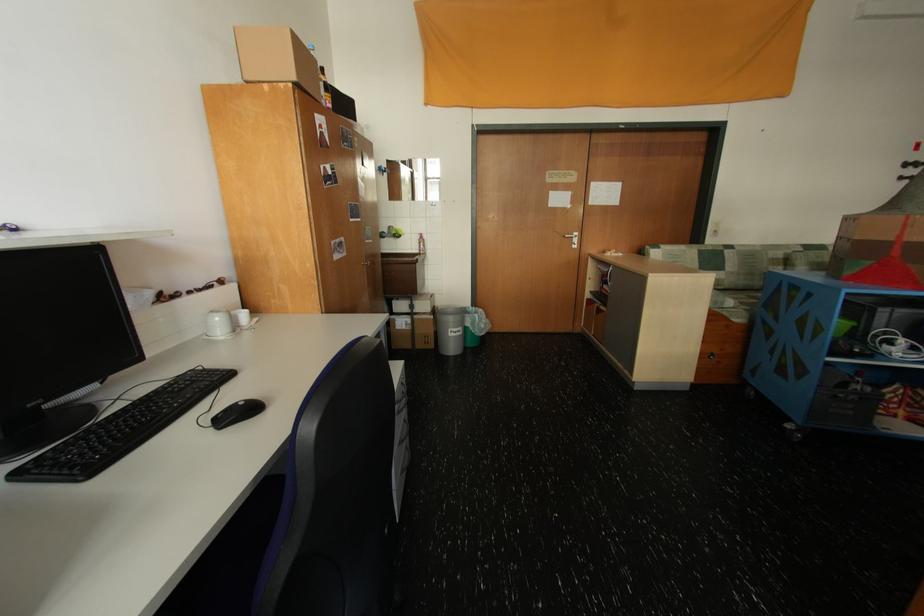
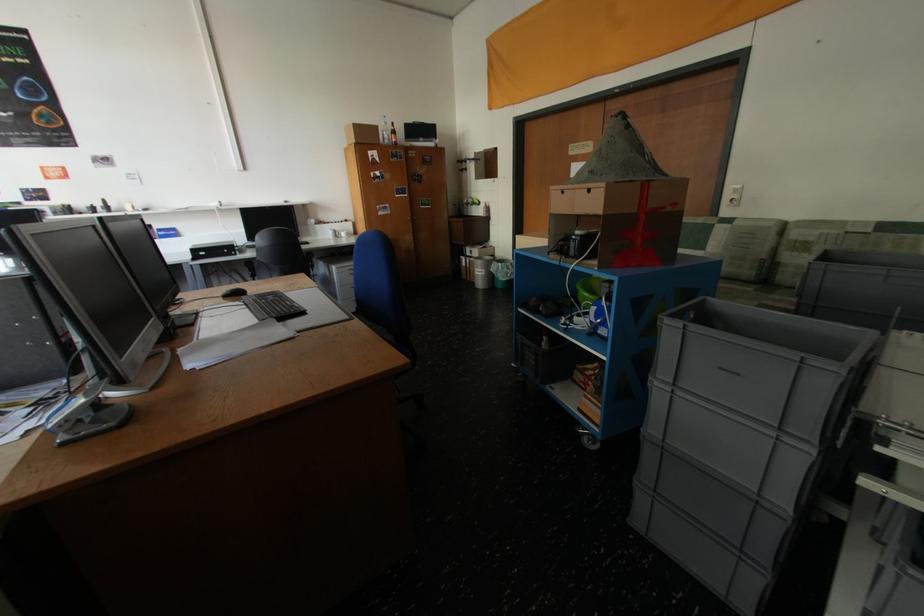
In the second image, find the point that corresponds to point 380,243 in the first image.

(439, 208)